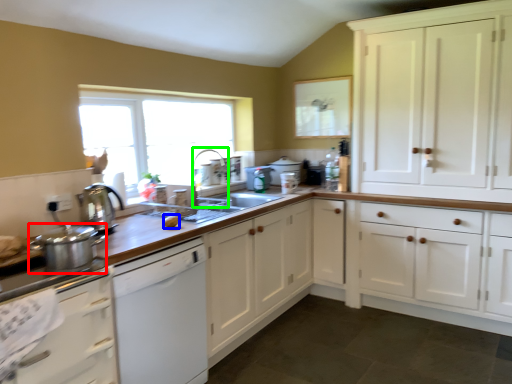
Question: Which object is the farthest from kitchen appliance (highlighted by a red box)? Choose among these: food (highlighted by a blue box) or faucet (highlighted by a green box).

Choices:
 (A) food
 (B) faucet

Answer: (B)